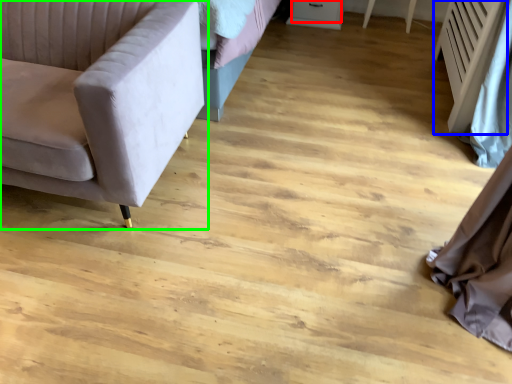
Question: Estimate the real-world distances between objects in this image. Which object is closer to drawer (highlighted by a red box), radiator (highlighted by a blue box) or studio couch (highlighted by a green box)?

Choices:
 (A) radiator
 (B) studio couch

Answer: (A)